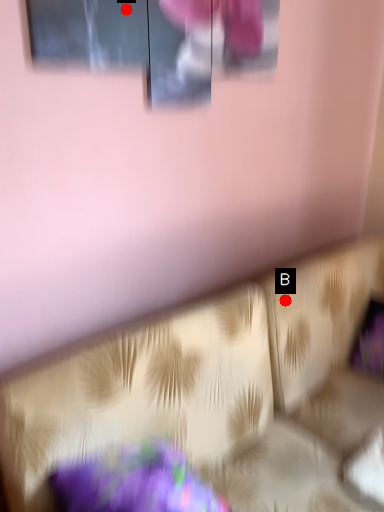
Question: Two points are circled on the image, labeled by A and B beside each circle. Which point is farther from the camera taking this photo?

Choices:
 (A) A is further
 (B) B is further

Answer: (B)